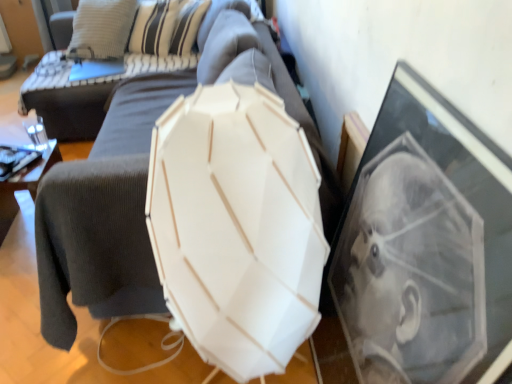
Question: In the image, is white matte umbrella at center positioned in front of or behind white matte lampshade at center?

Choices:
 (A) front
 (B) behind

Answer: (A)

Question: Considering the positions of white matte umbrella at center and white matte lampshade at center in the image, is white matte umbrella at center bigger or smaller than white matte lampshade at center?

Choices:
 (A) small
 (B) big

Answer: (A)

Question: Which is farther from the dark gray corduroy armchair at left?

Choices:
 (A) dark gray fabric couch at center
 (B) white matte umbrella at center
 (C) white matte lampshade at center

Answer: (B)

Question: Estimate the real-world distances between objects in this image. Which object is closer to the dark gray corduroy armchair at left?

Choices:
 (A) white matte lampshade at center
 (B) white matte umbrella at center
 (C) dark gray fabric couch at center

Answer: (C)